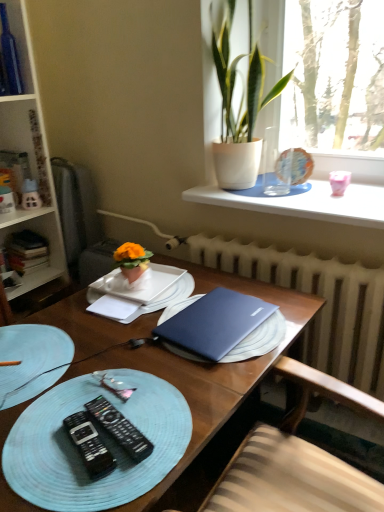
I want to click on unoccupied space behind black plastic remote control at lower left, positioned as the 1th remote control in left-to-right order, so click(x=104, y=387).